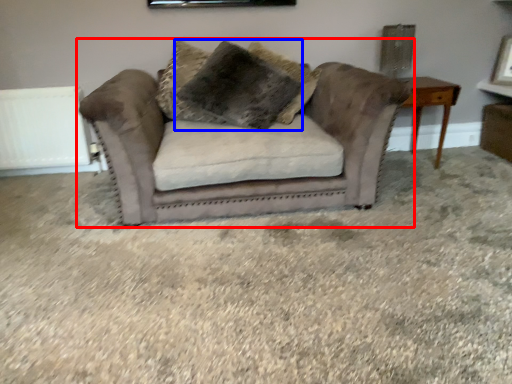
Question: Which object is further to the camera taking this photo, studio couch (highlighted by a red box) or pillow (highlighted by a blue box)?

Choices:
 (A) studio couch
 (B) pillow

Answer: (B)